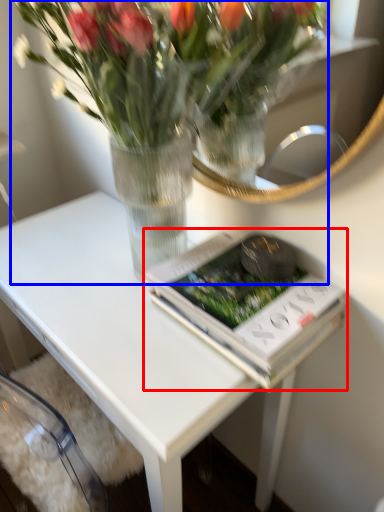
Question: Among these objects, which one is farthest to the camera, paperback book (highlighted by a red box) or houseplant (highlighted by a blue box)?

Choices:
 (A) paperback book
 (B) houseplant

Answer: (A)